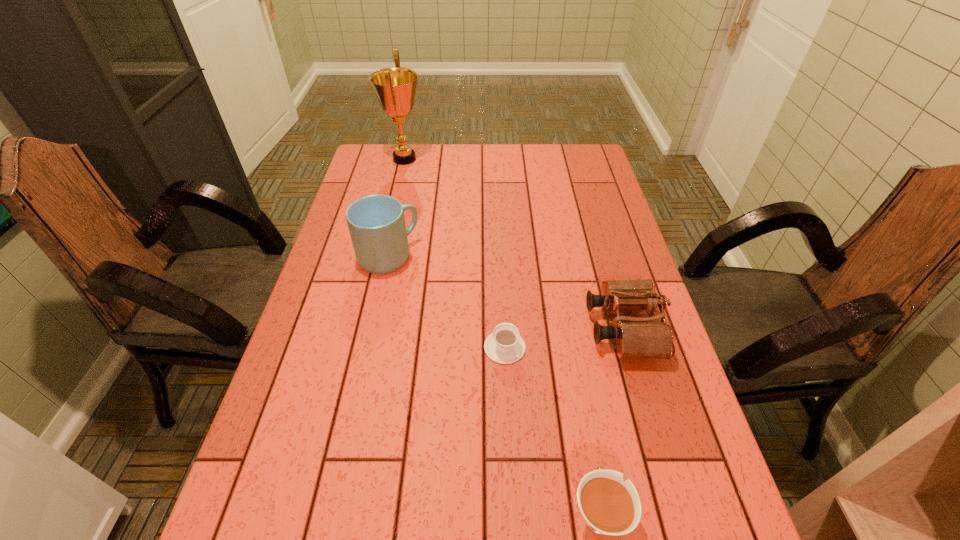
Locate an element on the screen. object at the far left corner is located at coordinates (395, 88).

Where is `free location at the far edge`? free location at the far edge is located at coordinates (449, 158).

What are the coordinates of `free spot at the left edge of the desktop` in the screenshot? It's located at (332, 273).

The image size is (960, 540). I want to click on free space at the right edge of the desktop, so click(x=610, y=199).

Where is `unoccupied area between the mug and the shortest object`? Image resolution: width=960 pixels, height=540 pixels. unoccupied area between the mug and the shortest object is located at coordinates (446, 302).

Where is `free space between the third shortest object and the shortest object`? free space between the third shortest object and the shortest object is located at coordinates (564, 338).

Image resolution: width=960 pixels, height=540 pixels. What are the coordinates of `free space that is in between the fourth nearest object and the farther teacup` in the screenshot? It's located at (446, 302).

You are a GUI agent. You are given a task and a screenshot of the screen. Output one action in this format:
    pyautogui.click(x=<x>, y=<y>)
    Task: Click on the blank region between the tallest object and the third object from left to right
    
    Given the screenshot: What is the action you would take?
    pyautogui.click(x=455, y=253)

The image size is (960, 540). I want to click on empty space that is in between the mug and the third shortest object, so click(506, 292).

Identify the location of unoccupied area between the mug and the binoculars. (506, 292).